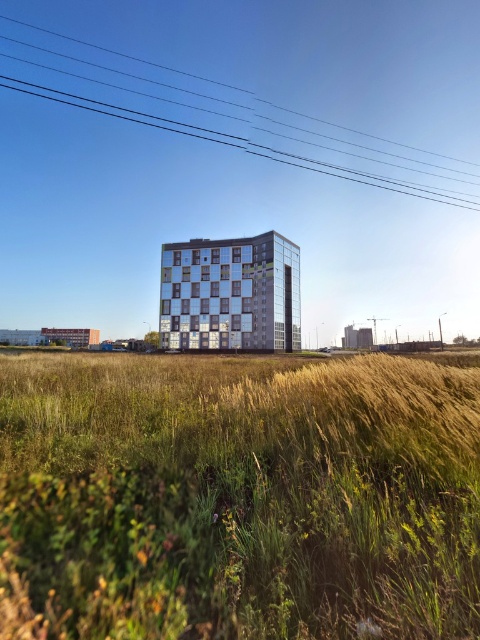
Based on the photo, can you confirm if green grass at center is shorter than clear wire at upper center?

Correct, green grass at center is not as tall as clear wire at upper center.

Is green grass at center to the left of clear wire at upper center from the viewer's perspective?

No, green grass at center is not to the left of clear wire at upper center.

Is point (471, 538) farther from viewer compared to point (136, 122)?

No, it is not.

This screenshot has height=640, width=480. I want to click on green grass at center, so (239, 497).